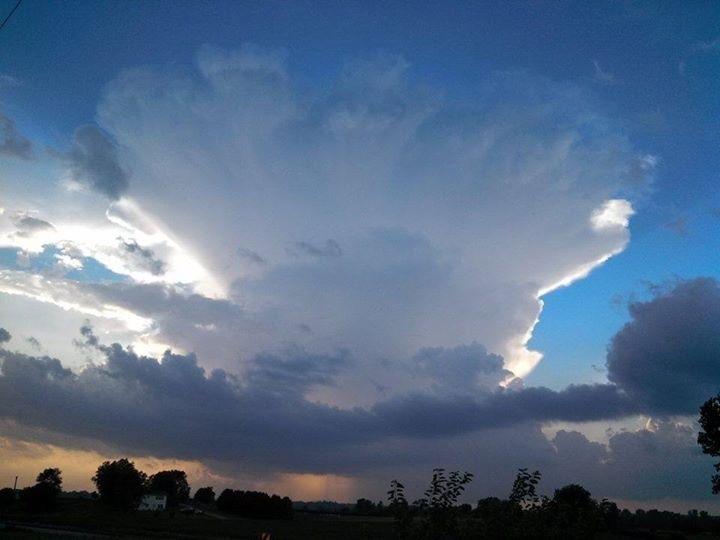
You are a GUI agent. You are given a task and a screenshot of the screen. Output one action in this format:
    pyautogui.click(x=<x>, y=<y>)
    Task: Click on the seems to be windows on the house
    
    Given the screenshot: What is the action you would take?
    pyautogui.click(x=158, y=499)